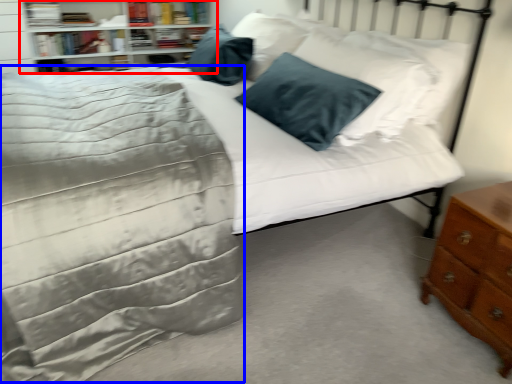
Question: Which of the following is the closest to the observer, shelf (highlighted by a red box) or bedding (highlighted by a blue box)?

Choices:
 (A) shelf
 (B) bedding

Answer: (B)